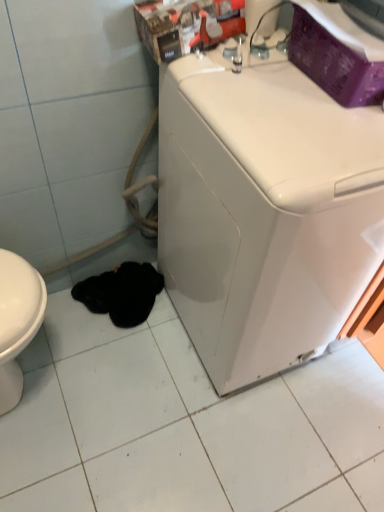
This screenshot has width=384, height=512. Identify the location of free space in front of black soft cloth at lower left. (112, 361).